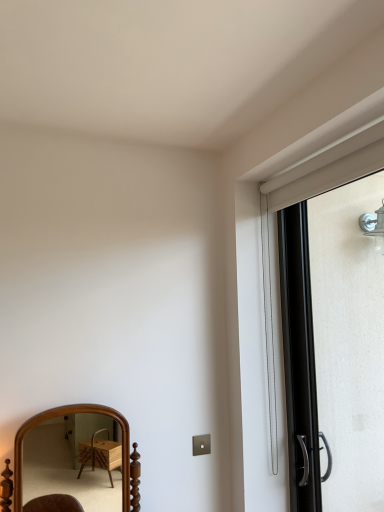
Question: Looking at the image, does wooden mirror at lower left seem bigger or smaller compared to black metallic screen door at right?

Choices:
 (A) small
 (B) big

Answer: (B)

Question: From the image's perspective, is wooden mirror at lower left positioned above or below black metallic screen door at right?

Choices:
 (A) above
 (B) below

Answer: (B)

Question: In terms of width, does wooden mirror at lower left look wider or thinner when compared to black metallic screen door at right?

Choices:
 (A) thin
 (B) wide

Answer: (B)

Question: Based on their positions, is black metallic screen door at right located to the left or right of wooden mirror at lower left?

Choices:
 (A) left
 (B) right

Answer: (B)

Question: Is black metallic screen door at right bigger or smaller than wooden mirror at lower left?

Choices:
 (A) small
 (B) big

Answer: (A)

Question: Is point (339, 249) closer or farther from the camera than point (79, 424)?

Choices:
 (A) farther
 (B) closer

Answer: (B)

Question: From their relative heights in the image, would you say black metallic screen door at right is taller or shorter than wooden mirror at lower left?

Choices:
 (A) tall
 (B) short

Answer: (A)